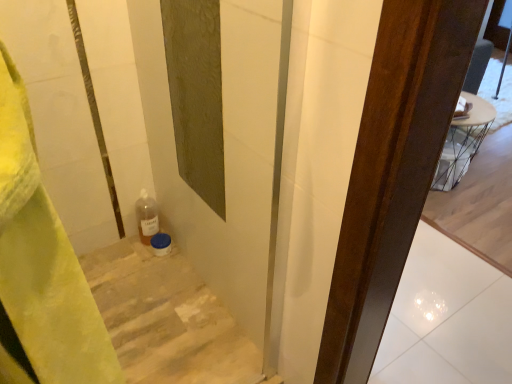
Question: Is point (252, 375) positioned closer to the camera than point (478, 307)?

Choices:
 (A) farther
 (B) closer

Answer: (B)

Question: Is wooden stairs at lower left in front of or behind white glossy tile at center in the image?

Choices:
 (A) front
 (B) behind

Answer: (A)

Question: From a real-world perspective, relative to white glossy tile at center, is wooden stairs at lower left vertically above or below?

Choices:
 (A) below
 (B) above

Answer: (B)

Question: In the image, is white glossy tile at center positioned in front of or behind wooden stairs at lower left?

Choices:
 (A) front
 (B) behind

Answer: (B)

Question: Considering the relative positions of white glossy tile at center and wooden stairs at lower left in the image provided, is white glossy tile at center to the left or to the right of wooden stairs at lower left?

Choices:
 (A) left
 (B) right

Answer: (B)

Question: Is point (424, 233) closer or farther from the camera than point (234, 362)?

Choices:
 (A) closer
 (B) farther

Answer: (B)

Question: Considering the positions of white glossy tile at center and wooden stairs at lower left in the image, is white glossy tile at center wider or thinner than wooden stairs at lower left?

Choices:
 (A) thin
 (B) wide

Answer: (B)